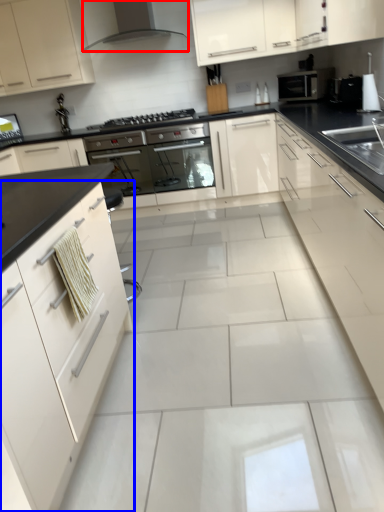
Question: Which of the following is the farthest to the observer, home appliance (highlighted by a red box) or cabinetry (highlighted by a blue box)?

Choices:
 (A) home appliance
 (B) cabinetry

Answer: (A)